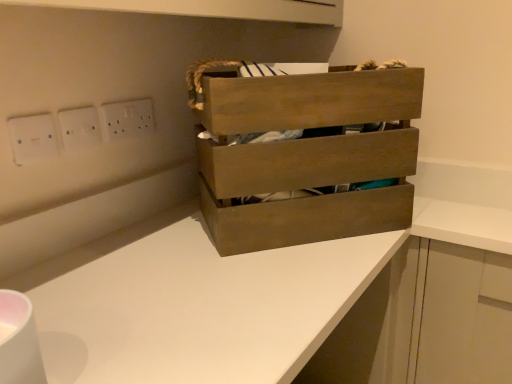
Locate an element on the screen. The image size is (512, 384). vacant area to the left of wooden crate at center is located at coordinates pos(134,245).